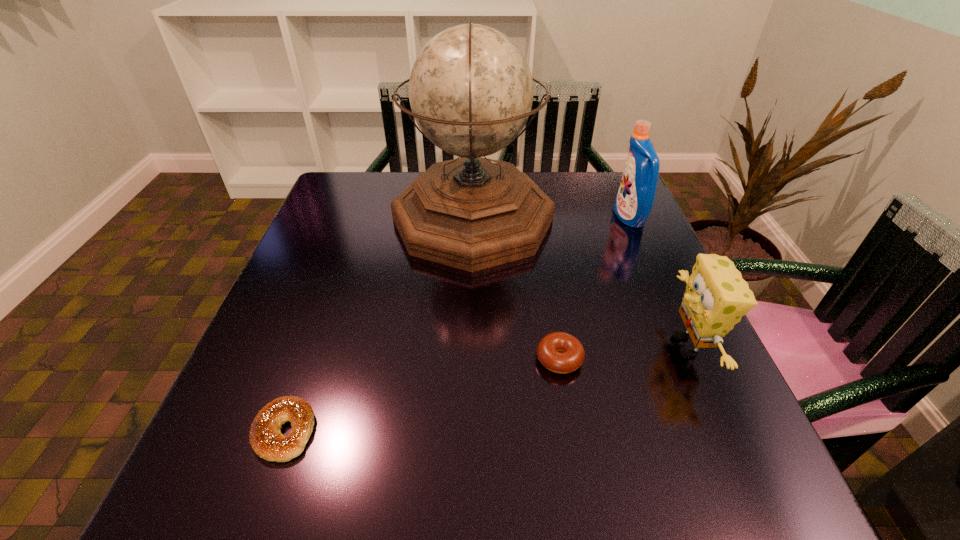
Image resolution: width=960 pixels, height=540 pixels. I want to click on free location that satisfies the following two spatial constraints: 1. on the surface of the tallest object; 2. on the left side of the fourth tallest object, so click(470, 359).

The image size is (960, 540). I want to click on free space that satisfies the following two spatial constraints: 1. on the surface of the tallest object; 2. on the left side of the doughnut, so click(x=470, y=359).

The height and width of the screenshot is (540, 960). Identify the location of free spot that satisfies the following two spatial constraints: 1. on the label of the detergent; 2. on the front side of the doughnut. (691, 359).

Find the location of a particular element. vacant region that satisfies the following two spatial constraints: 1. on the label of the detergent; 2. on the front side of the bagel is located at coordinates (723, 431).